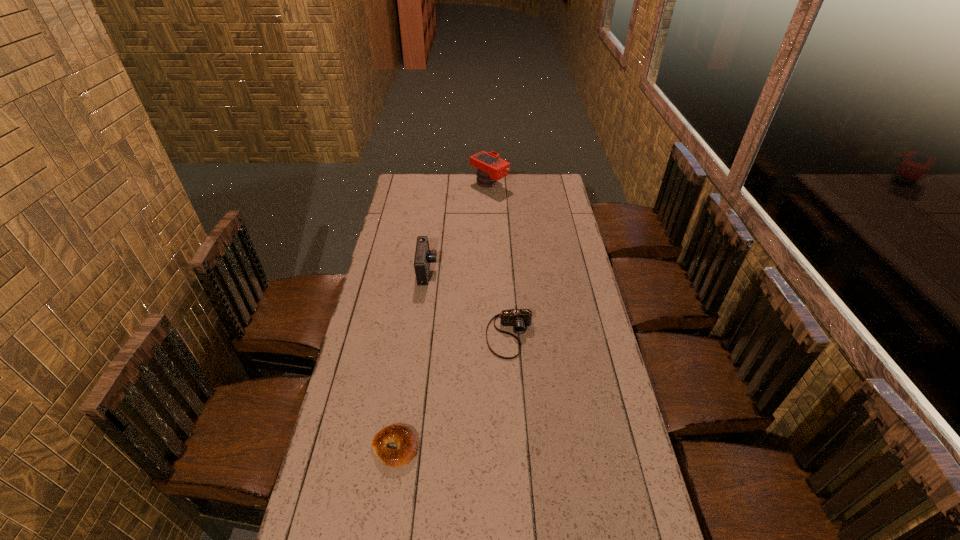
Locate an element on the screen. the tallest camera is located at coordinates (490, 167).

Image resolution: width=960 pixels, height=540 pixels. Identify the location of the tallest object. (490, 167).

Identify the location of the leftmost camera. Image resolution: width=960 pixels, height=540 pixels. (424, 256).

Locate an element on the screen. Image resolution: width=960 pixels, height=540 pixels. the third nearest object is located at coordinates (424, 256).

Locate an element on the screen. The height and width of the screenshot is (540, 960). the third farthest object is located at coordinates pos(520,318).

Where is `the third tallest object`? the third tallest object is located at coordinates coord(520,318).

You are a GUI agent. You are given a task and a screenshot of the screen. Output one action in this format:
    pyautogui.click(x=<x>, y=<y>)
    Task: Click on the shortest object
    
    Given the screenshot: What is the action you would take?
    pyautogui.click(x=401, y=435)

What are the coordinates of `the nearest object` in the screenshot? It's located at (401, 435).

The image size is (960, 540). In order to click on blank space located on the front of the tallest object in this screenshot , I will do `click(490, 200)`.

Find the location of `free space located on the front-facing side of the second farthest camera`. free space located on the front-facing side of the second farthest camera is located at coordinates (481, 272).